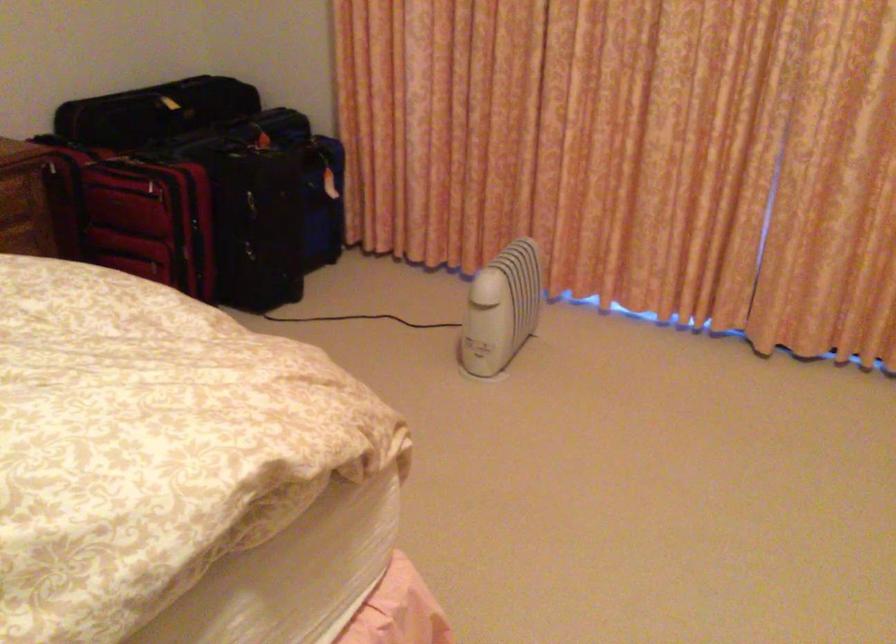
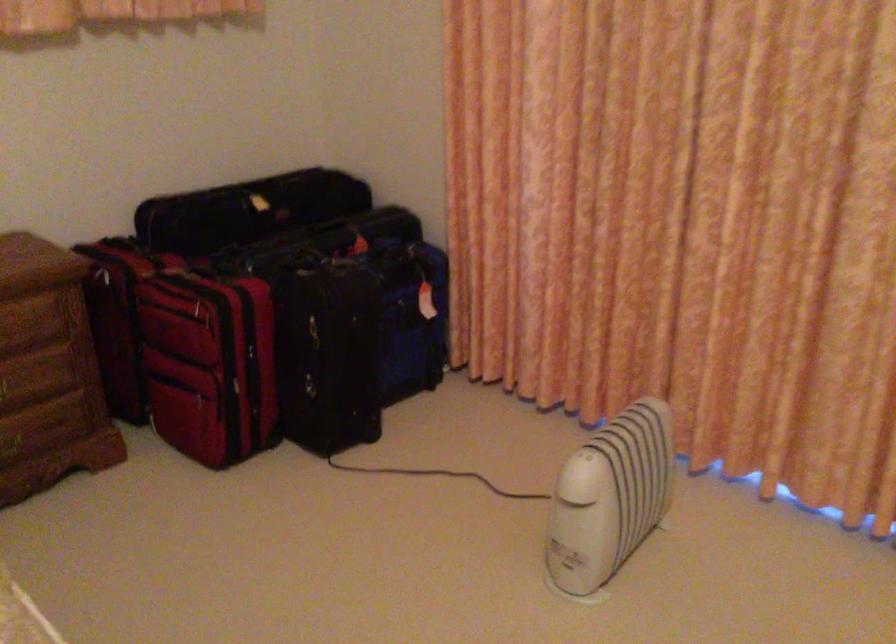
Locate, in the second image, the point that corresponds to pixel 160 243 in the first image.

(209, 364)